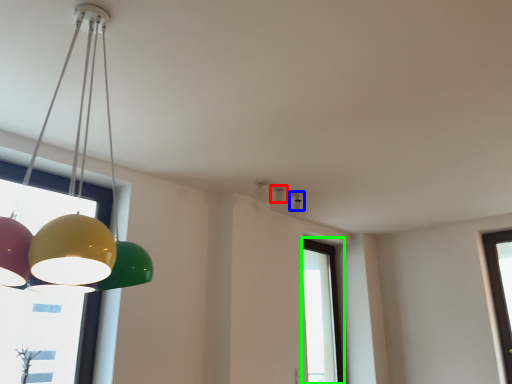
Question: Based on their relative distances, which object is farther from lamp (highlighted by a red box)? Choose from lamp (highlighted by a blue box) and window (highlighted by a green box).

Choices:
 (A) lamp
 (B) window

Answer: (B)